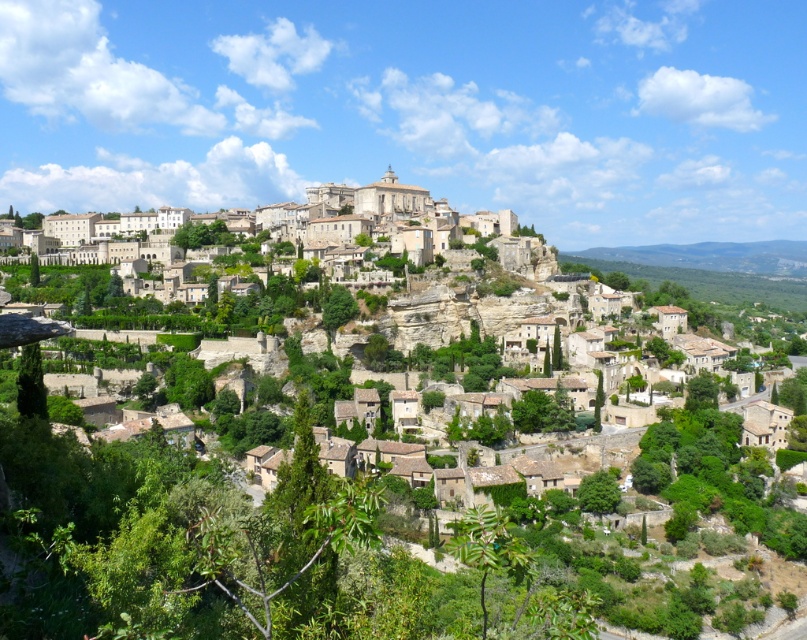
Can you confirm if beige stone buildings at upper center is thinner than brown stone buildings at center?

Correct, beige stone buildings at upper center's width is less than brown stone buildings at center's.

This screenshot has height=640, width=807. Describe the element at coordinates (345, 208) in the screenshot. I see `beige stone buildings at upper center` at that location.

Where is `beige stone buildings at upper center`? beige stone buildings at upper center is located at coordinates (345, 208).